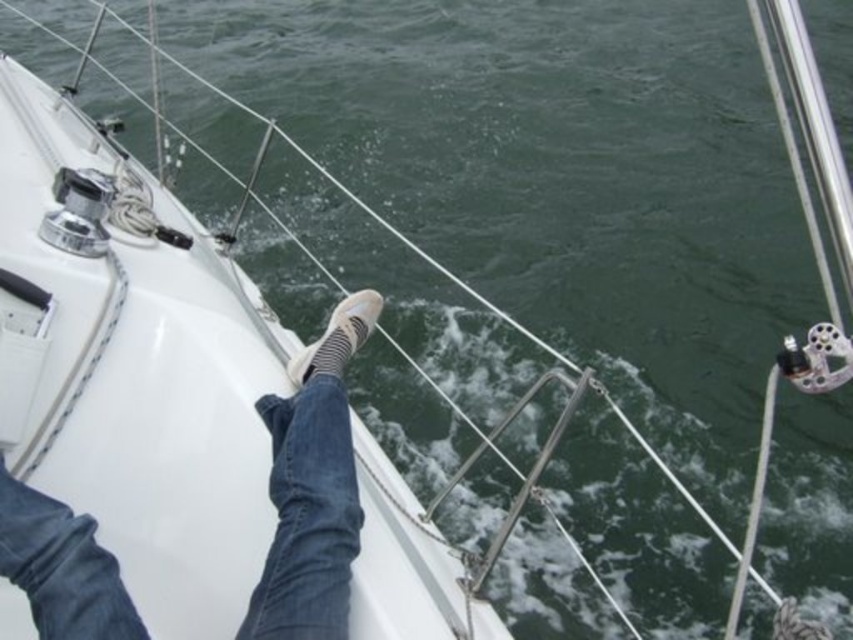
Which is behind, point (349, 424) or point (363, 312)?

The point (363, 312) is behind.

Is white striped socks at center shorter than white striped sock at center?

No.

The height and width of the screenshot is (640, 853). In order to click on white striped socks at center in this screenshot , I will do click(x=312, y=488).